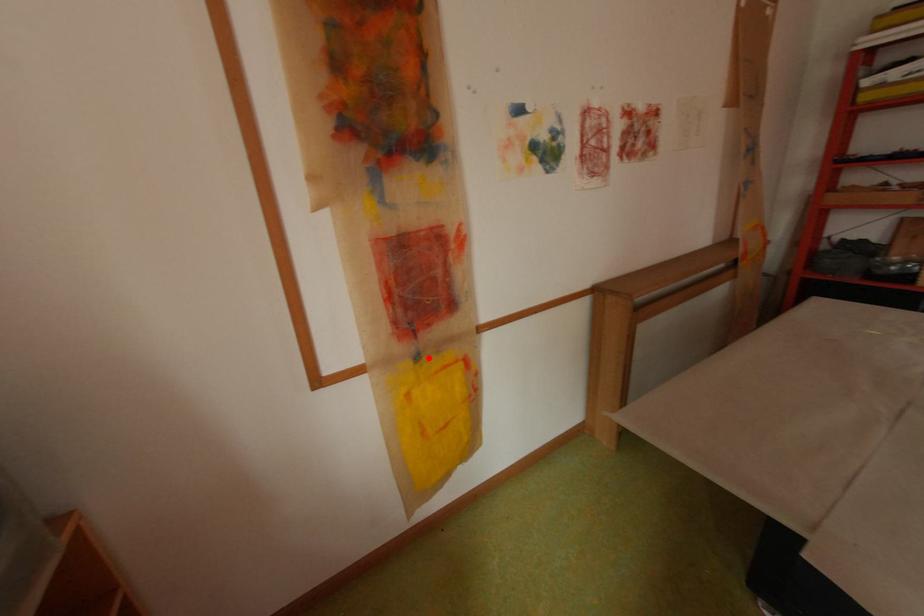
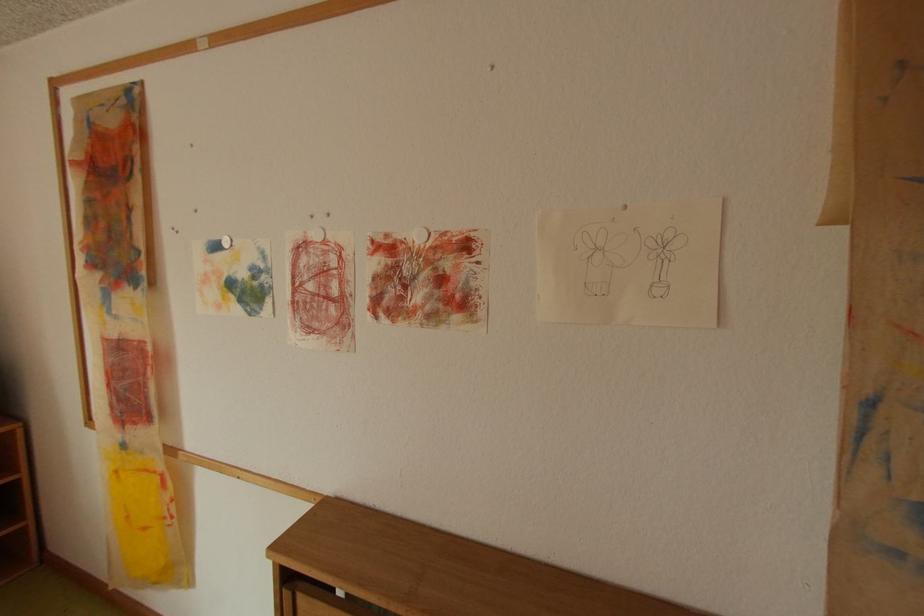
In the second image, find the point that corresponds to the highlighted location in the first image.

(134, 446)